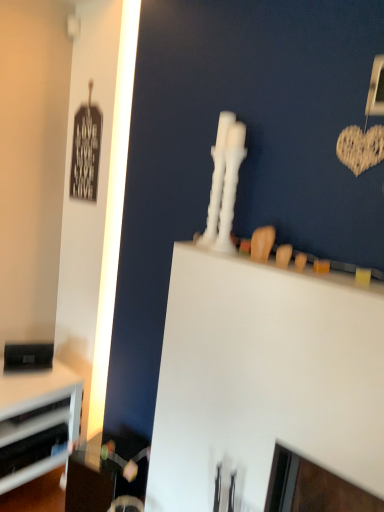
The width and height of the screenshot is (384, 512). Describe the element at coordinates (34, 421) in the screenshot. I see `brushed metal drawer at lower left, the 1th drawer in the top-to-bottom sequence` at that location.

Image resolution: width=384 pixels, height=512 pixels. What do you see at coordinates (28, 356) in the screenshot?
I see `black matte speaker at lower left` at bounding box center [28, 356].

The height and width of the screenshot is (512, 384). Identify the location of brushed metal drawer at lower left, positioned as the second drawer in bottom-to-top order. (34, 421).

Does point (242, 447) come farther from viewer compared to point (33, 429)?

No.

Is white matte computer desk at upper center far away from brushed metal drawer at lower left, positioned as the second drawer in bottom-to-top order?

Yes.

Does white matte computer desk at upper center turn towards brushed metal drawer at lower left, positioned as the second drawer in bottom-to-top order?

No, white matte computer desk at upper center is not facing towards brushed metal drawer at lower left, positioned as the second drawer in bottom-to-top order.

At what (x,y) coordinates should I click in order to perform the action: click on appliance above the white plastic drawer at lower left, positioned as the first drawer in bottom-to-top order (from the image's perspective). Please return your answer as a coordinate pair (x, y). Image resolution: width=384 pixels, height=512 pixels. Looking at the image, I should click on tap(28, 356).

Who is shorter, white plastic drawer at lower left, the 2th drawer positioned from the top, or black matte speaker at lower left?

Standing shorter between the two is white plastic drawer at lower left, the 2th drawer positioned from the top.

Is white plastic drawer at lower left, the 2th drawer positioned from the top, smaller than black matte speaker at lower left?

No.

Considering the positions of objects white plastic drawer at lower left, the 2th drawer positioned from the top, and black matte speaker at lower left in the image provided, who is more to the left, white plastic drawer at lower left, the 2th drawer positioned from the top, or black matte speaker at lower left?

From the viewer's perspective, black matte speaker at lower left appears more on the left side.

From a real-world perspective, does black matte speaker at lower left stand above white matte computer desk at upper center?

No, from a real-world perspective, black matte speaker at lower left is not above white matte computer desk at upper center.

From the picture: Can you confirm if black matte speaker at lower left is taller than white matte computer desk at upper center?

In fact, black matte speaker at lower left may be shorter than white matte computer desk at upper center.

From the image's perspective, is black matte speaker at lower left positioned above or below white matte computer desk at upper center?

From the image's perspective, black matte speaker at lower left appears above white matte computer desk at upper center.

Can you tell me how much black matte speaker at lower left and white matte computer desk at upper center differ in facing direction?

60.7 degrees.

Are black matte speaker at lower left and brushed metal drawer at lower left, positioned as the second drawer in bottom-to-top order, beside each other?

No, black matte speaker at lower left is not making contact with brushed metal drawer at lower left, positioned as the second drawer in bottom-to-top order.

Which point is more forward, [50,362] or [5,426]?

The point [5,426] is in front.

From a real-world perspective, which is physically above, black matte speaker at lower left or brushed metal drawer at lower left, positioned as the second drawer in bottom-to-top order?

From a 3D spatial view, black matte speaker at lower left is above.

Relative to brushed metal drawer at lower left, positioned as the second drawer in bottom-to-top order, is black matte speaker at lower left in front or behind?

Clearly, black matte speaker at lower left is behind brushed metal drawer at lower left, positioned as the second drawer in bottom-to-top order.

Is white plastic drawer at lower left, the 2th drawer positioned from the top, not near white matte computer desk at upper center?

Yes, white plastic drawer at lower left, the 2th drawer positioned from the top, is far from white matte computer desk at upper center.

Is point (3, 455) positioned behind point (292, 384)?

Yes, it is.

Is white plastic drawer at lower left, positioned as the first drawer in bottom-to-top order, oriented towards white matte computer desk at upper center?

No, white plastic drawer at lower left, positioned as the first drawer in bottom-to-top order, is not facing towards white matte computer desk at upper center.

Which object is more forward, white plastic drawer at lower left, the 2th drawer positioned from the top, or white matte computer desk at upper center?

Positioned in front is white matte computer desk at upper center.

Are brushed metal drawer at lower left, the 1th drawer in the top-to-bottom sequence, and white matte computer desk at upper center making contact?

There is a gap between brushed metal drawer at lower left, the 1th drawer in the top-to-bottom sequence, and white matte computer desk at upper center.

From the image's perspective, does brushed metal drawer at lower left, the 1th drawer in the top-to-bottom sequence, appear lower than white matte computer desk at upper center?

Indeed, from the image's perspective, brushed metal drawer at lower left, the 1th drawer in the top-to-bottom sequence, is shown beneath white matte computer desk at upper center.

Is brushed metal drawer at lower left, the 1th drawer in the top-to-bottom sequence, turned away from white matte computer desk at upper center?

No, brushed metal drawer at lower left, the 1th drawer in the top-to-bottom sequence,'s orientation is not away from white matte computer desk at upper center.

Is point (50, 413) closer or farther from the camera than point (198, 345)?

Point (50, 413) is farther from the camera than point (198, 345).

Which object is more forward, brushed metal drawer at lower left, positioned as the second drawer in bottom-to-top order, or black matte speaker at lower left?

Positioned in front is brushed metal drawer at lower left, positioned as the second drawer in bottom-to-top order.

Identify the location of drawer that is the 1st object located in front of the black matte speaker at lower left. (34, 421).

Does brushed metal drawer at lower left, positioned as the second drawer in bottom-to-top order, have a greater width compared to black matte speaker at lower left?

Incorrect, the width of brushed metal drawer at lower left, positioned as the second drawer in bottom-to-top order, does not surpass that of black matte speaker at lower left.

This screenshot has width=384, height=512. What are the coordinates of `computer desk in front of the brushed metal drawer at lower left, positioned as the second drawer in bottom-to-top order` in the screenshot? It's located at (264, 379).

Image resolution: width=384 pixels, height=512 pixels. I want to click on the 1st drawer to the right of the black matte speaker at lower left, starting your count from the anchor, so click(31, 449).

Consider the image. When comparing their distances from white plastic drawer at lower left, positioned as the first drawer in bottom-to-top order, does black matte speaker at lower left or white matte computer desk at upper center seem further?

Based on the image, white matte computer desk at upper center appears to be further to white plastic drawer at lower left, positioned as the first drawer in bottom-to-top order.

Based on their spatial positions, is brushed metal drawer at lower left, positioned as the second drawer in bottom-to-top order, or black matte speaker at lower left closer to white plastic drawer at lower left, the 2th drawer positioned from the top?

brushed metal drawer at lower left, positioned as the second drawer in bottom-to-top order, lies closer to white plastic drawer at lower left, the 2th drawer positioned from the top, than the other object.

Which object lies further to the anchor point black matte speaker at lower left, white matte computer desk at upper center or white plastic drawer at lower left, positioned as the first drawer in bottom-to-top order?

Among the two, white matte computer desk at upper center is located further to black matte speaker at lower left.

Which object lies further to the anchor point white matte computer desk at upper center, white plastic drawer at lower left, the 2th drawer positioned from the top, or brushed metal drawer at lower left, the 1th drawer in the top-to-bottom sequence?

white plastic drawer at lower left, the 2th drawer positioned from the top, lies further to white matte computer desk at upper center than the other object.

Considering their positions, is white plastic drawer at lower left, positioned as the first drawer in bottom-to-top order, positioned further to black matte speaker at lower left than white matte computer desk at upper center?

white matte computer desk at upper center is positioned further to the anchor black matte speaker at lower left.

When comparing their distances from brushed metal drawer at lower left, positioned as the second drawer in bottom-to-top order, does black matte speaker at lower left or white matte computer desk at upper center seem closer?

black matte speaker at lower left lies closer to brushed metal drawer at lower left, positioned as the second drawer in bottom-to-top order, than the other object.

When comparing their distances from white matte computer desk at upper center, does white plastic drawer at lower left, the 2th drawer positioned from the top, or black matte speaker at lower left seem further?

black matte speaker at lower left.

When comparing their distances from brushed metal drawer at lower left, the 1th drawer in the top-to-bottom sequence, does white matte computer desk at upper center or black matte speaker at lower left seem further?

The object further to brushed metal drawer at lower left, the 1th drawer in the top-to-bottom sequence, is white matte computer desk at upper center.

Where is `drawer between black matte speaker at lower left and white plastic drawer at lower left, positioned as the first drawer in bottom-to-top order, vertically`? drawer between black matte speaker at lower left and white plastic drawer at lower left, positioned as the first drawer in bottom-to-top order, vertically is located at coordinates (34, 421).

Image resolution: width=384 pixels, height=512 pixels. Find the location of `drawer between white plastic drawer at lower left, positioned as the first drawer in bottom-to-top order, and white matte computer desk at upper center`. drawer between white plastic drawer at lower left, positioned as the first drawer in bottom-to-top order, and white matte computer desk at upper center is located at coordinates (34, 421).